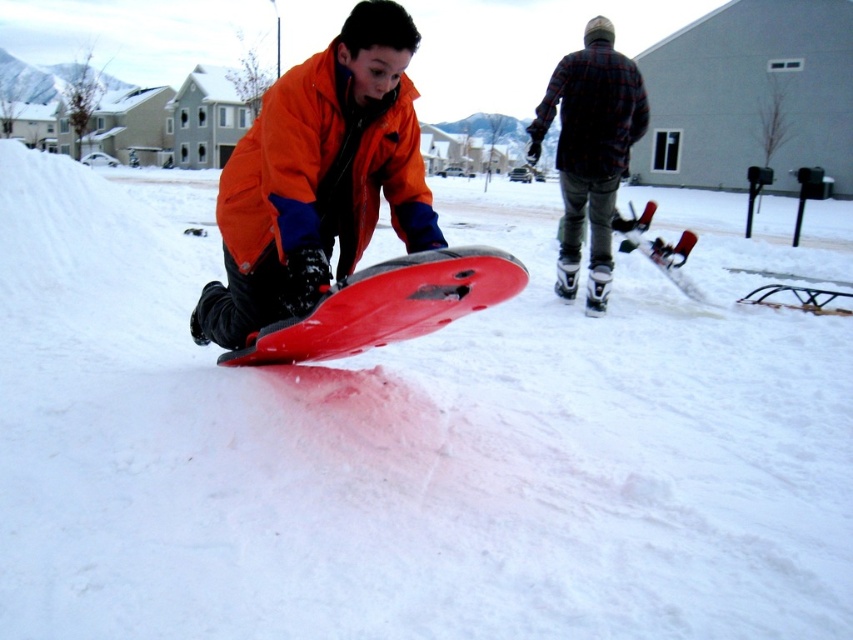
Question: Among these objects, which one is farthest from the camera?

Choices:
 (A) matte plastic snowboard at center
 (B) flannel plaid shirt at upper right

Answer: (B)

Question: Does shiny plastic snowboard at center appear on the right side of matte red snowboard at center?

Choices:
 (A) no
 (B) yes

Answer: (A)

Question: From the image, what is the correct spatial relationship of matte plastic snowboard at center in relation to flannel plaid shirt at upper right?

Choices:
 (A) right
 (B) left

Answer: (B)

Question: Does matte plastic snowboard at center come in front of flannel plaid shirt at upper right?

Choices:
 (A) yes
 (B) no

Answer: (A)

Question: Considering the real-world distances, which object is farthest from the flannel plaid shirt at upper right?

Choices:
 (A) matte red snowboard at center
 (B) matte plastic snowboard at center
 (C) shiny plastic snowboard at center
 (D) orange fleece jacket at center

Answer: (C)

Question: Which of the following is the closest to the observer?

Choices:
 (A) coord(276,88)
 (B) coord(300,212)
 (C) coord(695,300)
 (D) coord(381,292)

Answer: (D)